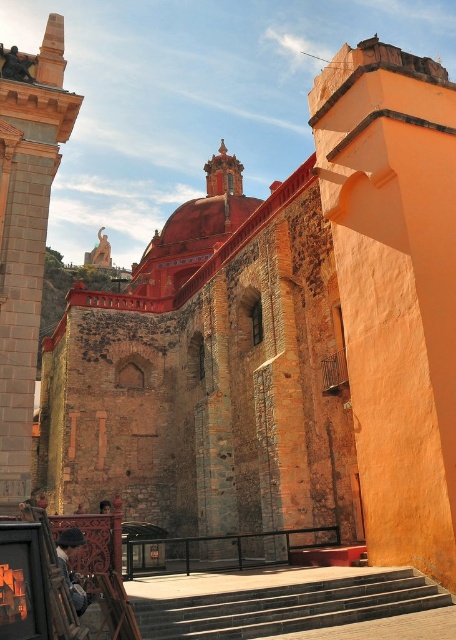
In the scene shown: Based on the scene description, what can be found at the coordinate point (25, 232)?

At the coordinate point (25, 232), there is a smooth stone tower at left.

You are planning to take a photo of the smooth stone tower at left and the smooth stone stairs at center. Since you want both objects to appear equally prominent in the photo, which object should you move closer to, and which should you move farther away?

Since the smooth stone tower at left is larger than the smooth stone stairs at center, you should move closer to the smooth stone stairs at center and move farther away from the smooth stone tower at left to balance their prominence in the photo.

You are standing at the entrance of the historic building and want to take a photo of both the smooth stone tower at left and the smooth stone stairs at center. Which object should you position to your left to include both in the frame?

The smooth stone tower at left is positioned on the left side of smooth stone stairs at center, so you should position the smooth stone stairs at center to your right to have the smooth stone tower at left on your left side, ensuring both are in the frame.